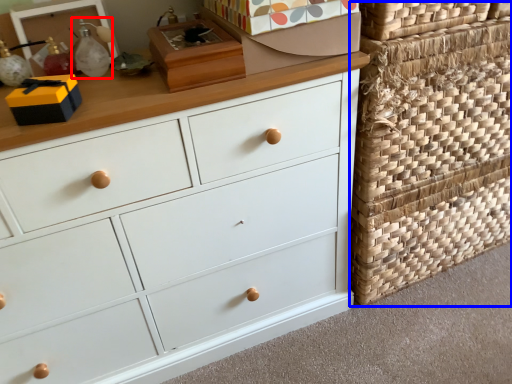
Question: Which object appears closest to the camera in this image, toy (highlighted by a red box) or basket (highlighted by a blue box)?

Choices:
 (A) toy
 (B) basket

Answer: (A)